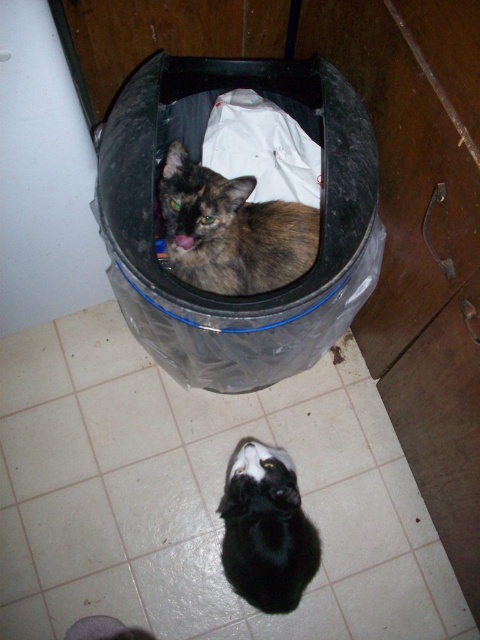
Can you confirm if brown fur cat at center is positioned to the right of black glossy cat at lower center?

In fact, brown fur cat at center is to the left of black glossy cat at lower center.

Does brown fur cat at center appear over black glossy cat at lower center?

Yes, brown fur cat at center is above black glossy cat at lower center.

Image resolution: width=480 pixels, height=640 pixels. What do you see at coordinates (230, 230) in the screenshot? I see `brown fur cat at center` at bounding box center [230, 230].

At what (x,y) coordinates should I click in order to perform the action: click on brown fur cat at center. Please return your answer as a coordinate pair (x, y). Looking at the image, I should click on (230, 230).

Locate an element on the screen. This screenshot has width=480, height=640. brown fur cat at center is located at coordinates (230, 230).

Can you confirm if brown fur cat at center is wider than white fabric at center?

Indeed, brown fur cat at center has a greater width compared to white fabric at center.

Does point (205, 180) lie behind point (253, 176)?

No, (205, 180) is in front of (253, 176).

Find the location of a particular element. The width and height of the screenshot is (480, 640). brown fur cat at center is located at coordinates (230, 230).

Does black glossy cat at lower center have a larger size compared to white fabric at center?

Indeed, black glossy cat at lower center has a larger size compared to white fabric at center.

Can you confirm if black glossy cat at lower center is shorter than white fabric at center?

No, black glossy cat at lower center is not shorter than white fabric at center.

You are a GUI agent. You are given a task and a screenshot of the screen. Output one action in this format:
    pyautogui.click(x=<x>, y=<y>)
    Task: Click on the black glossy cat at lower center
    The height and width of the screenshot is (640, 480).
    Given the screenshot: What is the action you would take?
    pyautogui.click(x=266, y=531)

Find the location of `black glossy cat at lower center`. black glossy cat at lower center is located at coordinates (266, 531).